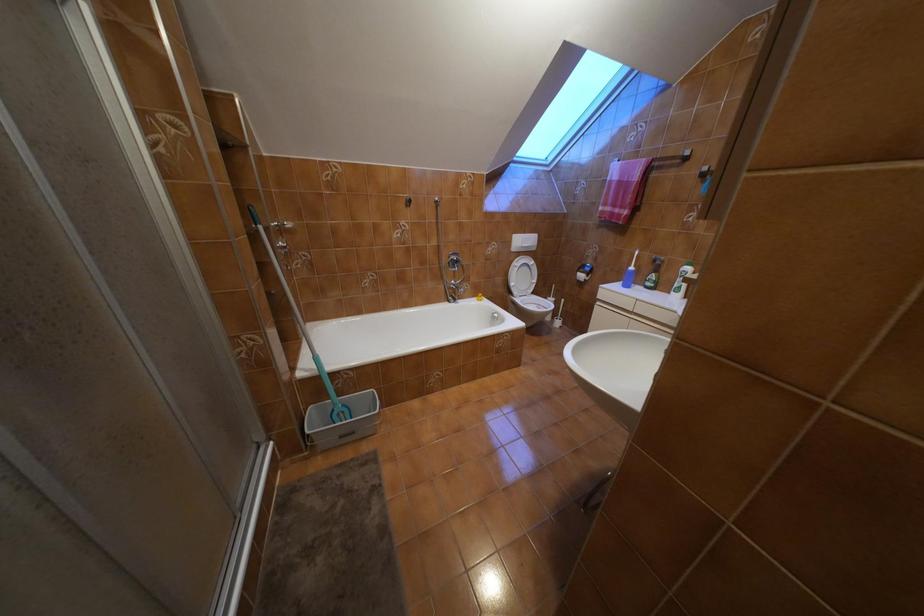
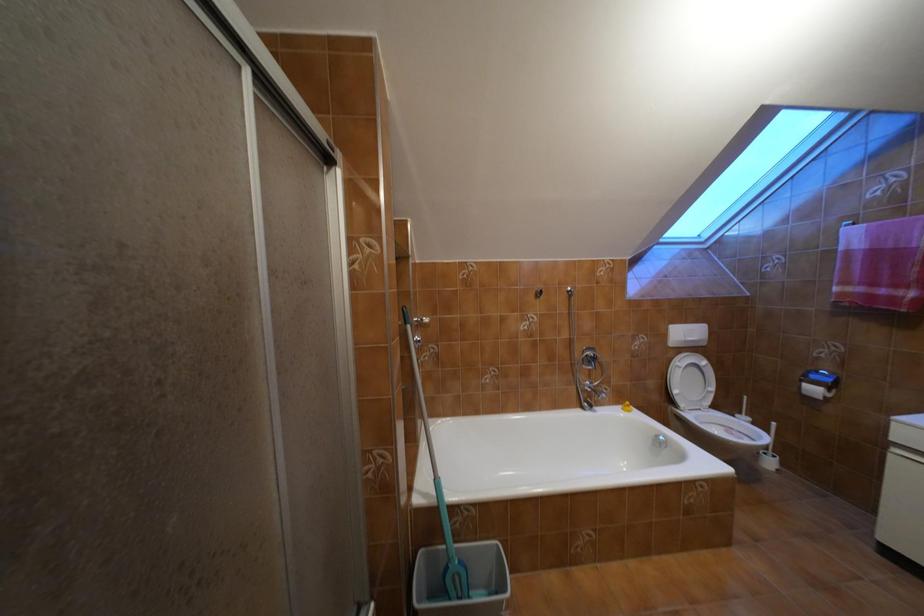
In a continuous first-person perspective shot, in which direction is the camera moving?

The movement direction of the cameraman is left, forward.